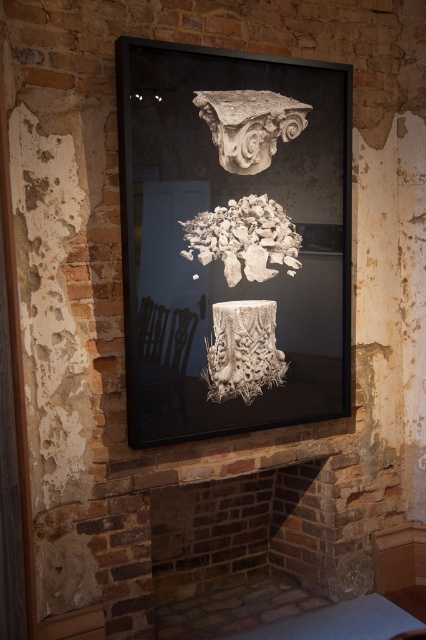
You are an art conservator examining the framed artwork. You notice the white stone column capital at upper center and the white textured column at center. Which one appears closer to the viewer?

The white textured column at center appears closer to the viewer because the white stone column capital at upper center is positioned behind it.

You are an art conservator examining the framed artwork. You notice two points of interest marked at coordinates point (216, 307) and point (262, 145). Which point is closer to the viewer?

Point (216, 307) is closer to the viewer as it is in front of point (262, 145).

You are an art conservator examining the framed artwork. You notice two elements within the frame. The first is the white stone column capital at upper center and the second is the white textured rubble at center. Based on their positions, which element is located to the left of the other?

The white textured rubble at center is to the left of the white stone column capital at upper center.